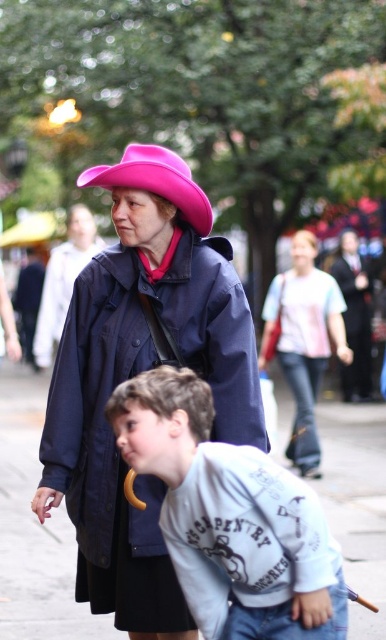
Question: Can you confirm if white cotton shirt at lower center is bigger than pink matte/cloth cowboy hat at upper center?

Choices:
 (A) no
 (B) yes

Answer: (A)

Question: Which point appears farthest from the camera in this image?

Choices:
 (A) (94, 186)
 (B) (189, 573)
 (C) (88, 360)

Answer: (A)

Question: Which object is closer to the camera taking this photo?

Choices:
 (A) navy blue coat at center
 (B) dark gray suit at center
 (C) white cotton shirt at lower center
 (D) white cotton shirt at center

Answer: (C)

Question: Is navy blue coat at center positioned in front of pink matte/cloth cowboy hat at upper center?

Choices:
 (A) no
 (B) yes

Answer: (B)

Question: Does matte black coat at upper center have a smaller size compared to dark gray suit at center?

Choices:
 (A) no
 (B) yes

Answer: (A)

Question: Among these objects, which one is farthest from the camera?

Choices:
 (A) white cotton shirt at center
 (B) matte black coat at upper center
 (C) pink matte/cloth cowboy hat at upper center
 (D) dark gray suit at center

Answer: (D)